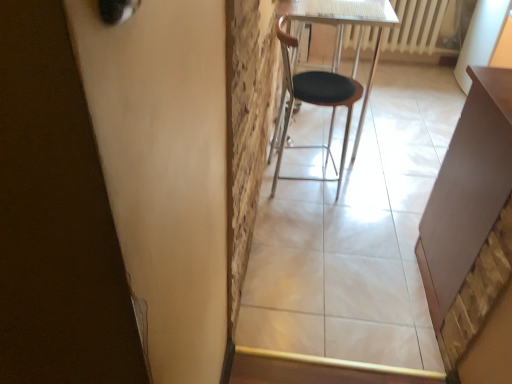
Describe the element at coordinates (418, 30) in the screenshot. I see `white plastic radiator at upper right` at that location.

Find the location of a particular element. Image resolution: width=512 pixels, height=384 pixels. white plastic radiator at upper right is located at coordinates (418, 30).

Is black leather chair at center positioned beyond the bounds of matte brown table at right?

Yes, black leather chair at center is not within matte brown table at right.

Is black leather chair at center not near matte brown table at right?

Actually, black leather chair at center and matte brown table at right are a little close together.

From a real-world perspective, does black leather chair at center sit lower than matte brown table at right?

Yes, from a real-world perspective, black leather chair at center is under matte brown table at right.

Is matte brown table at right oriented away from white plastic radiator at upper right?

No.

Between point (486, 204) and point (433, 38), which one is positioned behind?

The point (433, 38) is behind.

Considering the relative sizes of matte brown table at right and white plastic radiator at upper right in the image provided, is matte brown table at right taller than white plastic radiator at upper right?

Yes.

Considering the relative sizes of matte brown table at right and white plastic radiator at upper right in the image provided, is matte brown table at right smaller than white plastic radiator at upper right?

No, matte brown table at right is not smaller than white plastic radiator at upper right.

From a real-world perspective, is matte brown table at right above or below black leather chair at center?

In terms of real-world spatial position, matte brown table at right is above black leather chair at center.

Between matte brown table at right and black leather chair at center, which one has larger width?

matte brown table at right is wider.

Is matte brown table at right facing away from black leather chair at center?

No, matte brown table at right is not facing away from black leather chair at center.

Can you tell me how much matte brown table at right and black leather chair at center differ in facing direction?

They differ by 83.2 degrees in their facing directions.

Could you tell me if white plastic radiator at upper right is facing matte brown table at right?

Yes, white plastic radiator at upper right is aimed at matte brown table at right.

Which object is closer to the camera taking this photo, white plastic radiator at upper right or matte brown table at right?

matte brown table at right.

From the image's perspective, which is above, white plastic radiator at upper right or matte brown table at right?

white plastic radiator at upper right.

From a real-world perspective, which is physically above, white plastic radiator at upper right or black leather chair at center?

black leather chair at center.

Locate an element on the screen. The image size is (512, 384). radiator above the black leather chair at center (from the image's perspective) is located at coordinates (418, 30).

Can you confirm if white plastic radiator at upper right is smaller than black leather chair at center?

Yes.

Considering the relative positions of black leather chair at center and white plastic radiator at upper right in the image provided, is black leather chair at center to the left or to the right of white plastic radiator at upper right?

In the image, black leather chair at center appears on the left side of white plastic radiator at upper right.

What's the angular difference between black leather chair at center and white plastic radiator at upper right's facing directions?

The angular difference between black leather chair at center and white plastic radiator at upper right is 96.9 degrees.

Does point (351, 94) lie in front of point (411, 4)?

Yes, point (351, 94) is closer to viewer.

Image resolution: width=512 pixels, height=384 pixels. Find the location of `table in front of the black leather chair at center`. table in front of the black leather chair at center is located at coordinates (467, 189).

Image resolution: width=512 pixels, height=384 pixels. Find the location of `radiator behind the matte brown table at right`. radiator behind the matte brown table at right is located at coordinates (418, 30).

Considering their positions, is white plastic radiator at upper right positioned closer to black leather chair at center than matte brown table at right?

Based on the image, matte brown table at right appears to be nearer to black leather chair at center.

Considering their positions, is black leather chair at center positioned further to white plastic radiator at upper right than matte brown table at right?

matte brown table at right is positioned further to the anchor white plastic radiator at upper right.

Looking at the image, which one is located further to white plastic radiator at upper right, matte brown table at right or black leather chair at center?

matte brown table at right is positioned further to the anchor white plastic radiator at upper right.

Considering their positions, is matte brown table at right positioned further to black leather chair at center than white plastic radiator at upper right?

Among the two, white plastic radiator at upper right is located further to black leather chair at center.

From the image, which object appears to be nearer to matte brown table at right, black leather chair at center or white plastic radiator at upper right?

black leather chair at center is positioned closer to the anchor matte brown table at right.

Estimate the real-world distances between objects in this image. Which object is closer to matte brown table at right, white plastic radiator at upper right or black leather chair at center?

black leather chair at center.

Where is `chair positioned between matte brown table at right and white plastic radiator at upper right from near to far`? The height and width of the screenshot is (384, 512). chair positioned between matte brown table at right and white plastic radiator at upper right from near to far is located at coordinates (315, 102).